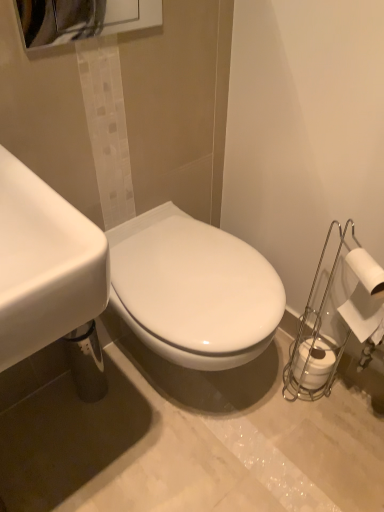
Question: From the image's perspective, relative to white matte toilet paper at right, the second toilet paper in the bottom-to-top sequence, is white matte toilet paper at lower right, marked as the first toilet paper in a back-to-front arrangement, above or below?

Choices:
 (A) above
 (B) below

Answer: (B)

Question: Is white matte toilet paper at lower right, arranged as the second toilet paper when viewed from the top, situated inside white matte toilet paper at right, the 2th toilet paper positioned from the back, or outside?

Choices:
 (A) outside
 (B) inside

Answer: (A)

Question: Based on their relative distances, which object is farther from the white glossy sink at left?

Choices:
 (A) white matte toilet paper at lower right, which is the second toilet paper from front to back
 (B) white matte toilet paper at right, the 2th toilet paper positioned from the back

Answer: (A)

Question: Which is nearer to the white matte toilet paper at lower right, which is the second toilet paper from front to back?

Choices:
 (A) white matte toilet paper at right, the 2th toilet paper positioned from the back
 (B) white glossy sink at left

Answer: (A)